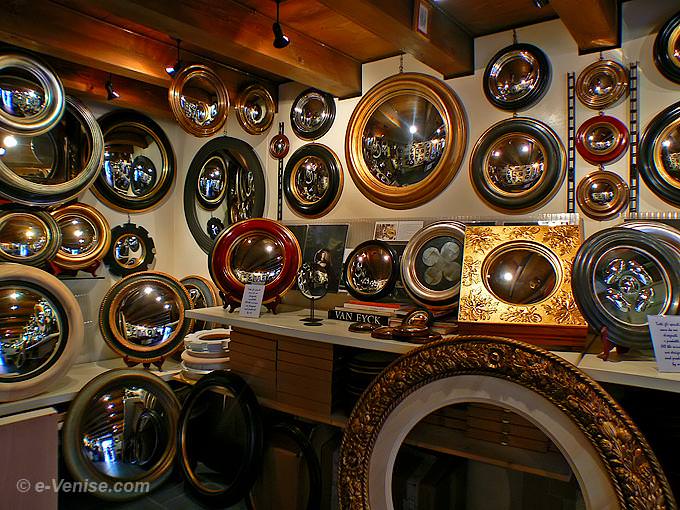
Please find where i would view my reflection in the image and show me where they are. Your answer should be formatted as a list of tuples, i.e. [(x1, y1), (x2, y2), ...], where each tuple contains the x and y coordinates of a point satisfying the conditions above.

[(385, 133)]